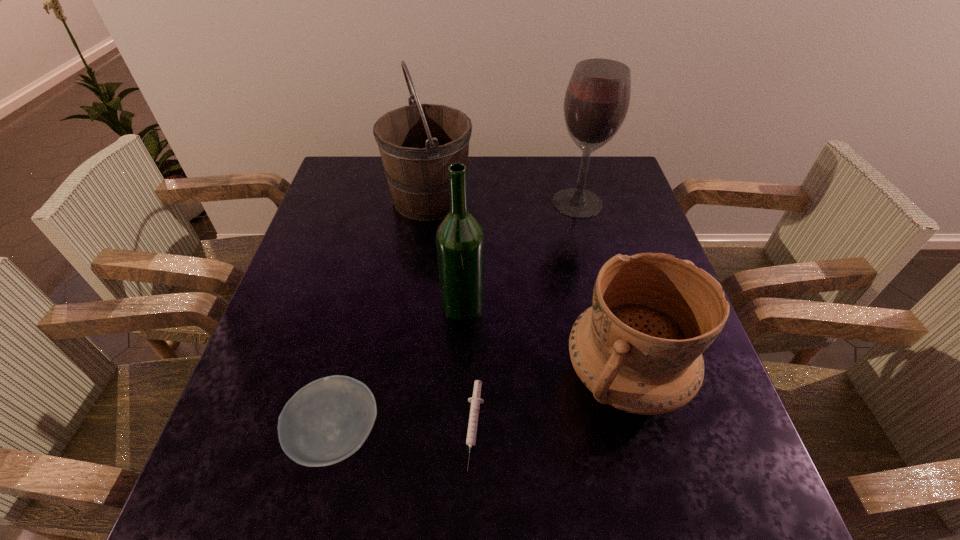
Where is `vacant space located on the right of the fourth tallest object`? This screenshot has height=540, width=960. vacant space located on the right of the fourth tallest object is located at coordinates (710, 375).

Identify the location of vacant region located on the back of the bowl. (359, 336).

At what (x,y) coordinates should I click in order to perform the action: click on free space located on the left of the shortest object. Please return your answer as a coordinate pair (x, y). Image resolution: width=960 pixels, height=540 pixels. Looking at the image, I should click on (260, 426).

Locate an element on the screen. The width and height of the screenshot is (960, 540). bucket that is at the far edge is located at coordinates (417, 143).

Identify the location of alcohol that is at the far edge. The width and height of the screenshot is (960, 540). (596, 102).

You are a GUI agent. You are given a task and a screenshot of the screen. Output one action in this format:
    pyautogui.click(x=<x>, y=<y>)
    Task: Click on the object located in the near edge section of the desktop
    The height and width of the screenshot is (540, 960).
    Given the screenshot: What is the action you would take?
    pyautogui.click(x=328, y=420)

Find the location of a particular element. object located at the left edge is located at coordinates (328, 420).

This screenshot has width=960, height=540. In order to click on alcohol present at the right edge in this screenshot , I will do `click(596, 102)`.

Find the location of a particular element. pottery at the right edge is located at coordinates (638, 348).

Where is `object at the near left corner`? object at the near left corner is located at coordinates (328, 420).